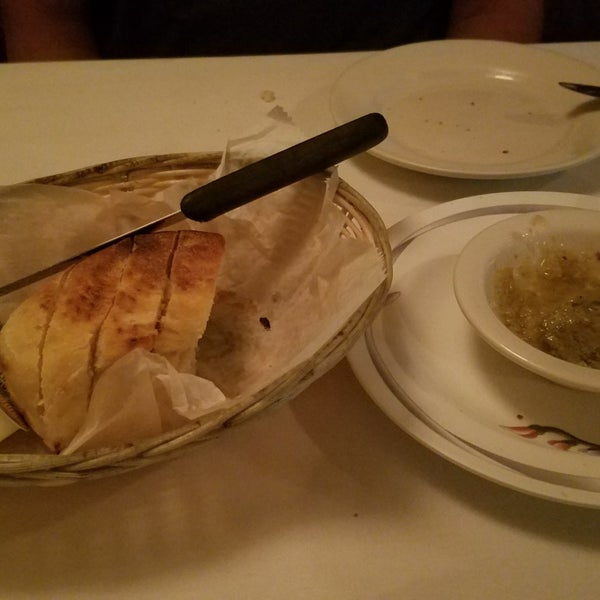
This screenshot has height=600, width=600. I want to click on black handle, so click(285, 167).